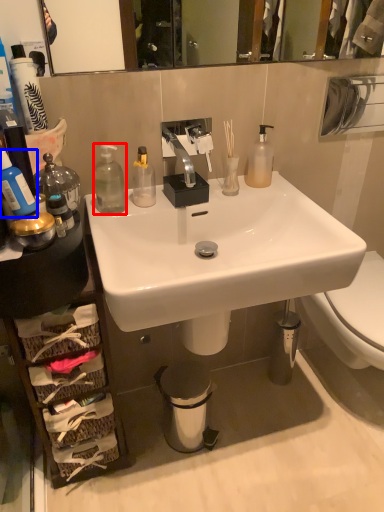
Question: Which point is further to the camera, bottle (highlighted by a red box) or bottle (highlighted by a blue box)?

Choices:
 (A) bottle
 (B) bottle

Answer: (A)